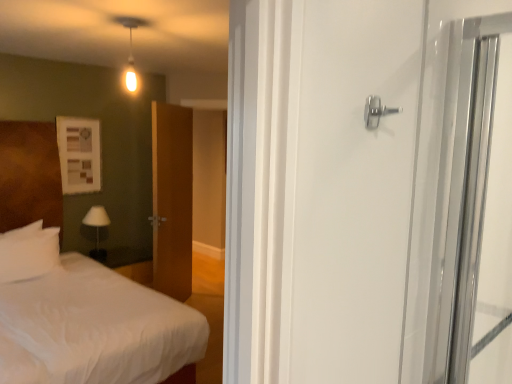
Question: In the image, is white soft pillow at left positioned in front of or behind polished silver door handle at upper right?

Choices:
 (A) front
 (B) behind

Answer: (B)

Question: From a real-world perspective, is white soft pillow at left above or below polished silver door handle at upper right?

Choices:
 (A) below
 (B) above

Answer: (A)

Question: Estimate the real-world distances between objects in this image. Which object is closer to the white soft pillow at left?

Choices:
 (A) polished silver door handle at upper right
 (B) white soft bed at left
 (C) white fabric lampshade at left

Answer: (B)

Question: Considering the real-world distances, which object is closest to the polished silver door handle at upper right?

Choices:
 (A) white fabric lampshade at left
 (B) white soft pillow at left
 (C) white soft bed at left

Answer: (B)